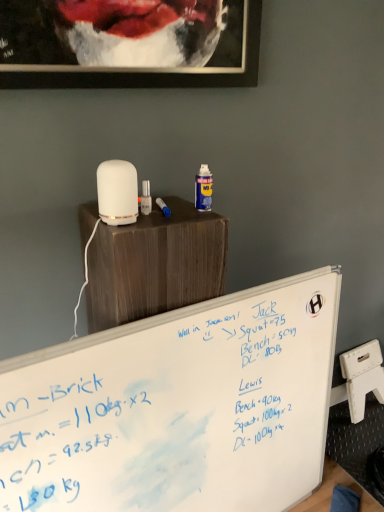
Question: Should I look upward or downward to see black matte picture frame at upper center?

Choices:
 (A) down
 (B) up

Answer: (B)